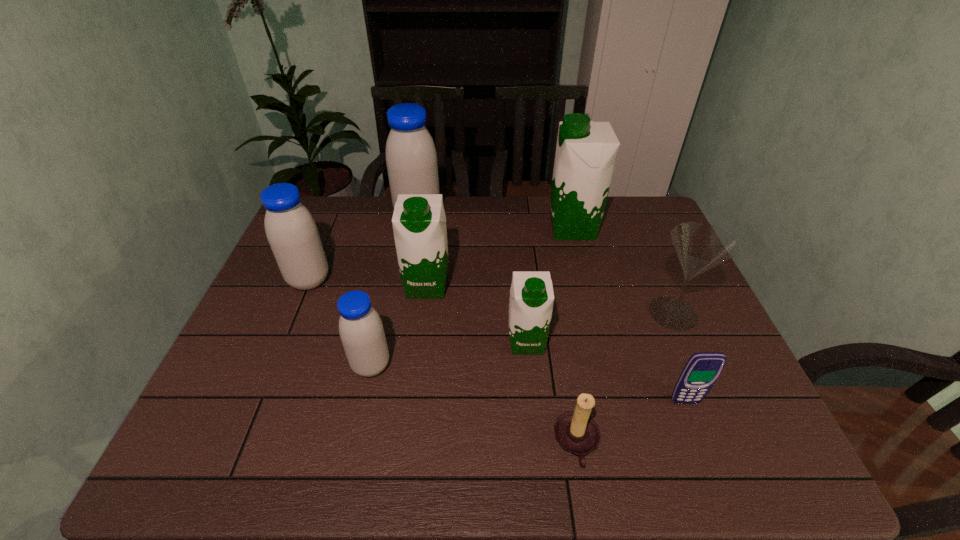
This screenshot has height=540, width=960. In order to click on blank space located 0.230m on the back of the flute glass in this screenshot , I will do `click(643, 242)`.

Image resolution: width=960 pixels, height=540 pixels. Identify the location of vacant area located on the front-facing side of the fifth soya milk from left to right. (536, 431).

Find the location of a particular element. The width and height of the screenshot is (960, 540). blank area located 0.180m on the left of the smallest blue soya milk is located at coordinates (276, 366).

You are a GUI agent. You are given a task and a screenshot of the screen. Output one action in this format:
    pyautogui.click(x=<x>, y=<y>)
    Task: Click on the vacant region located 0.150m on the front-facing side of the eighth farthest object
    The width and height of the screenshot is (960, 540).
    Given the screenshot: What is the action you would take?
    click(x=712, y=472)

I want to click on free space located 0.240m on the wick of the candle holder, so click(438, 444).

Where is `free spot located on the wick of the candle holder`? The height and width of the screenshot is (540, 960). free spot located on the wick of the candle holder is located at coordinates (371, 444).

Where is `blank space located 0.110m on the wick of the candle holder`? blank space located 0.110m on the wick of the candle holder is located at coordinates (500, 444).

Where is `object at the near edge`? object at the near edge is located at coordinates (578, 434).

The width and height of the screenshot is (960, 540). In order to click on object present at the left edge in this screenshot , I will do coord(291,231).

Locate an element on the screen. Image resolution: width=960 pixels, height=540 pixels. flute glass that is at the right edge is located at coordinates (700, 247).